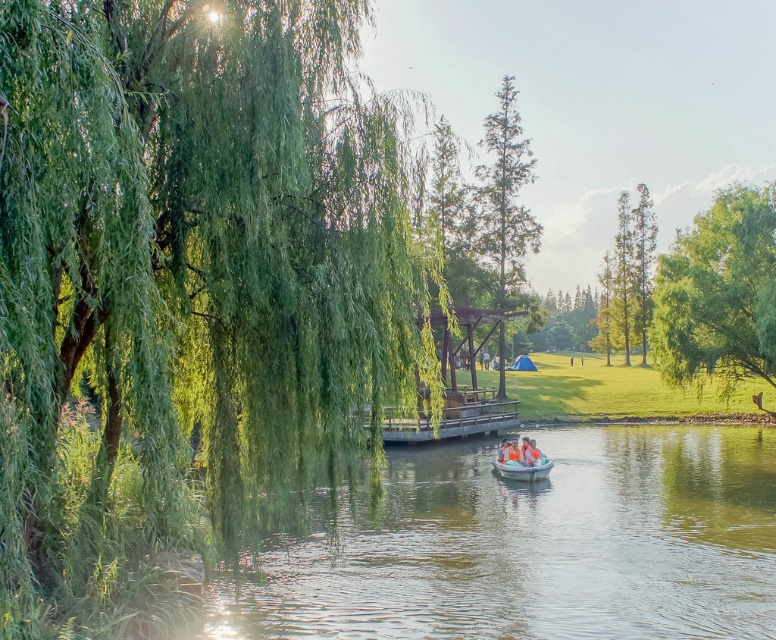
Between green leafy tree at center and green smooth tree at upper right, which one has less height?

green smooth tree at upper right

Is point (508, 147) closer to viewer compared to point (645, 296)?

Yes, it is.

Locate an element on the screen. Image resolution: width=776 pixels, height=640 pixels. green leafy tree at center is located at coordinates (504, 195).

You are a GUI agent. You are given a task and a screenshot of the screen. Output one action in this format:
    pyautogui.click(x=<x>, y=<y>)
    Task: Click on the green leafy tree at center
    This screenshot has height=640, width=776.
    Given the screenshot: What is the action you would take?
    pyautogui.click(x=504, y=195)

Is green leafy willow at left closer to camera compared to green leafy tree at center?

Yes, green leafy willow at left is closer to the viewer.

Looking at this image, does green leafy willow at left come behind green leafy tree at center?

No, it is not.

Between point (286, 392) and point (494, 236), which one is positioned in front?

Point (286, 392) is more forward.

Identify the location of green leafy willow at left. The height and width of the screenshot is (640, 776). (186, 275).

Looking at this image, who is lower down, green smooth tree at upper right or orange fabric canoe at center?

orange fabric canoe at center is lower down.

Can you confirm if green smooth tree at upper right is positioned below orange fabric canoe at center?

No, green smooth tree at upper right is not below orange fabric canoe at center.

Between point (639, 230) and point (504, 461), which one is positioned in front?

Point (504, 461) is more forward.

Identify the location of green smooth tree at upper right. (629, 276).